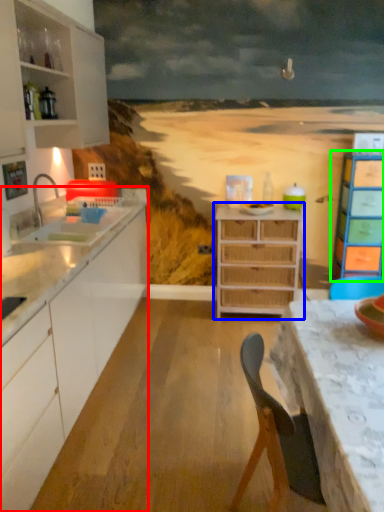
Question: Based on their relative distances, which object is farther from cabinetry (highlighted by a red box)? Choose from chest of drawers (highlighted by a blue box) and chest of drawers (highlighted by a green box).

Choices:
 (A) chest of drawers
 (B) chest of drawers

Answer: (B)